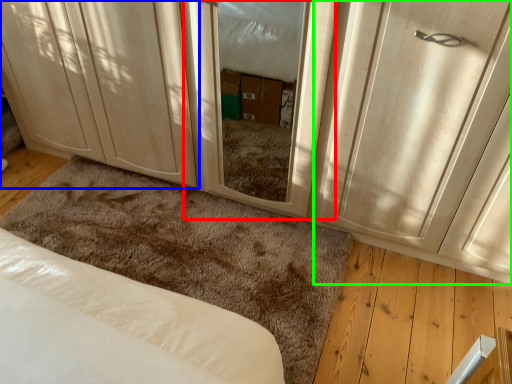
Question: Which object is the farthest from screen door (highlighted by a red box)? Choose among these: cabinetry (highlighted by a blue box) or door (highlighted by a green box).

Choices:
 (A) cabinetry
 (B) door

Answer: (A)